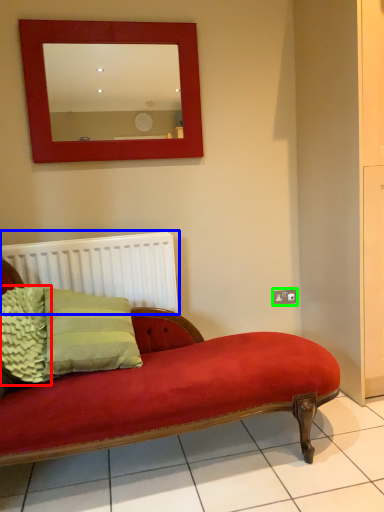
Question: Estimate the real-world distances between objects in this image. Which object is closer to pillow (highlighted by a red box), radiator (highlighted by a blue box) or electric outlet (highlighted by a green box)?

Choices:
 (A) radiator
 (B) electric outlet

Answer: (A)